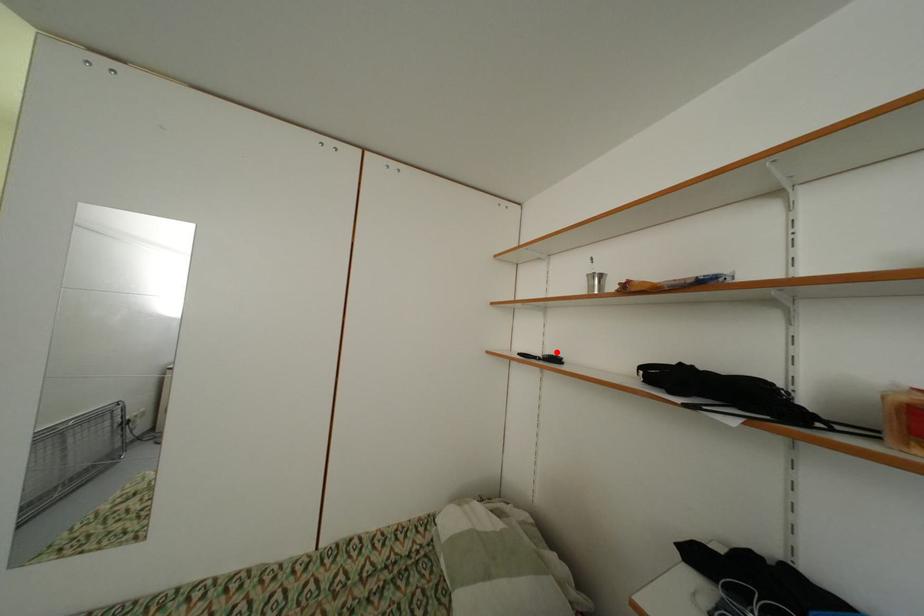
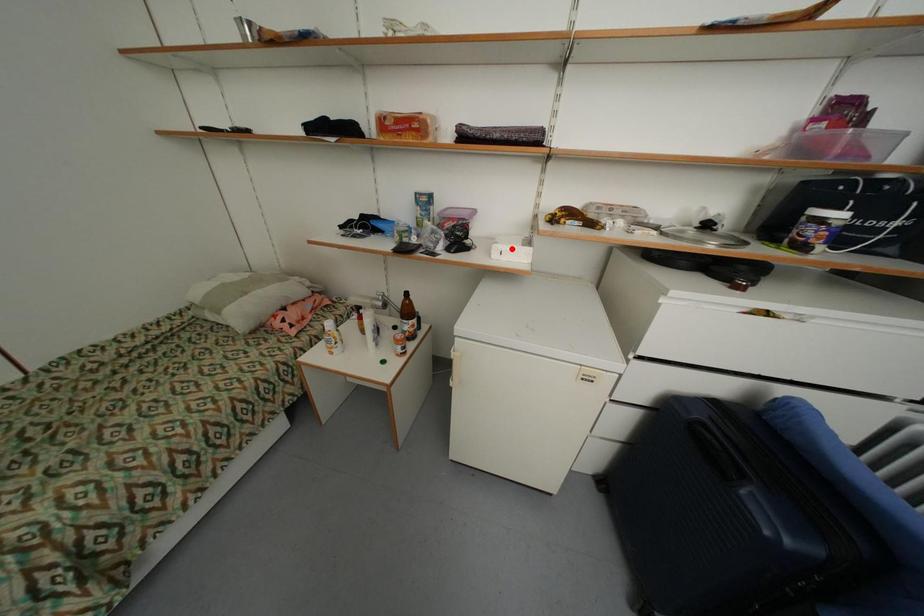
I am providing you with two images of the same scene from different viewpoints. A red point is marked on the first image and another point is marked on the second image. Are the points marked in image1 and image2 representing the same 3D position?

No